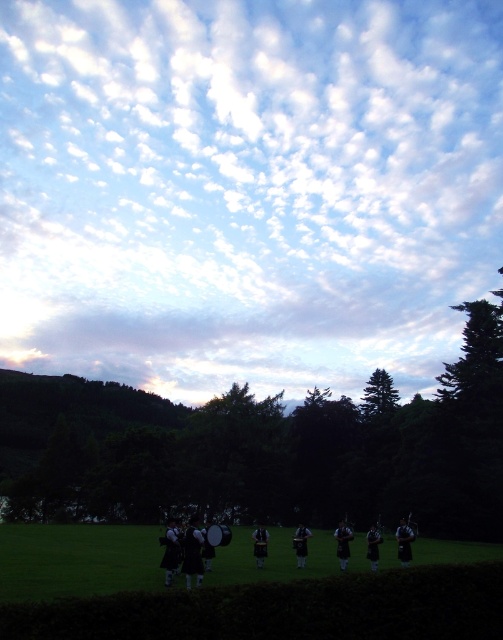
Who is shorter, white fluffy clouds at upper center or shiny black bagpipes at center?

With less height is shiny black bagpipes at center.

Is white fluffy clouds at upper center shorter than shiny black bagpipes at center?

No, white fluffy clouds at upper center is not shorter than shiny black bagpipes at center.

Find the location of `white fluffy clouds at upper center`. white fluffy clouds at upper center is located at coordinates (246, 189).

Is point (346, 548) more distant than point (293, 538)?

That is False.

Which of these two, dark blue fabric bagpipe at center or shiny black bagpipes at center, stands taller?

shiny black bagpipes at center is taller.

This screenshot has height=640, width=503. What do you see at coordinates (343, 544) in the screenshot?
I see `dark blue fabric bagpipe at center` at bounding box center [343, 544].

This screenshot has height=640, width=503. What are the coordinates of `dark blue fabric bagpipe at center` in the screenshot? It's located at (343, 544).

Between white fluffy clouds at upper center and dark blue fabric bagpipe at center, which one is positioned lower?

Positioned lower is dark blue fabric bagpipe at center.

Can you confirm if white fluffy clouds at upper center is smaller than dark blue fabric bagpipe at center?

Incorrect, white fluffy clouds at upper center is not smaller in size than dark blue fabric bagpipe at center.

Locate an element on the screen. The width and height of the screenshot is (503, 640). white fluffy clouds at upper center is located at coordinates (246, 189).

Locate an element on the screen. This screenshot has height=640, width=503. white fluffy clouds at upper center is located at coordinates (246, 189).